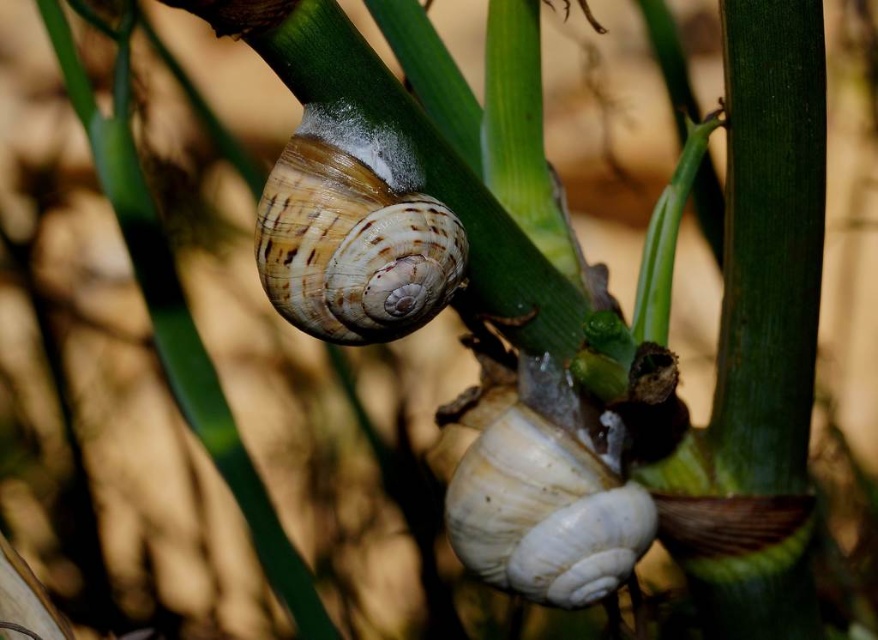
You are a gardener looking at the image of two snails on plant stems. You need to determine which snail is closer to you. The snails are the brown striped shell at center and the white matte snail at center. Which one is closer?

The brown striped shell at center is closer because it is in front of the white matte snail at center.

You are observing two snails on plant stems. The snail with the brown striped shell at center is positioned at coordinates 0.364 on the x and 0.404 on the y. Can you determine if this snail is higher up on the stem compared to the other snail?

The brown striped shell at center is located at point (354,232). Since the coordinates are given without reference to the other snail, we cannot determine its relative position without additional information about the other snail.

You are a biologist observing two snails on plant stems. The snail with a brown striped shell is at point (354, 232). Where exactly is the brown striped shell located in the image?

The brown striped shell at center is located at point (354, 232).